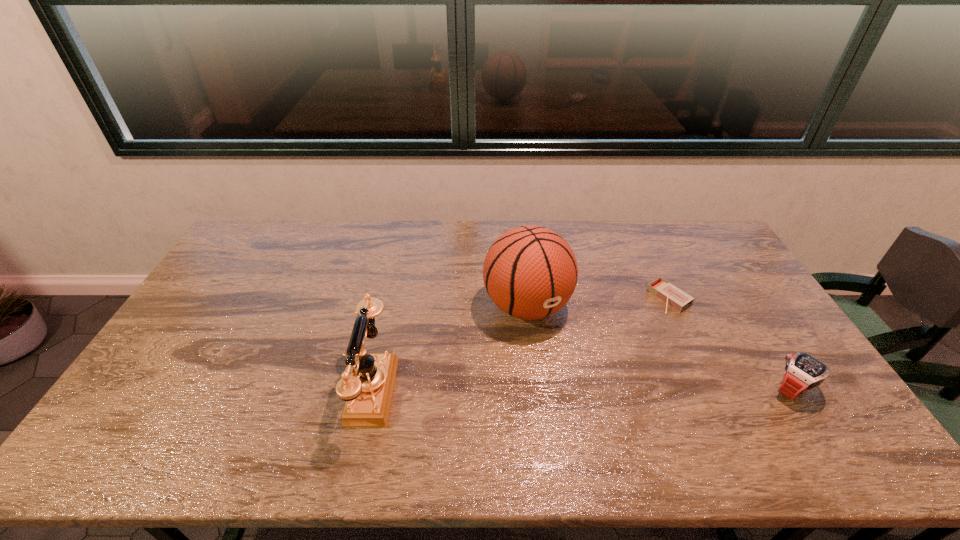
You are a GUI agent. You are given a task and a screenshot of the screen. Output one action in this format:
    pyautogui.click(x=<x>, y=<y>)
    Task: Click on the vacant region that satisfies the following two spatial constraints: 1. on the front side of the rightmost object; 2. on the right side of the matchbox
    This screenshot has width=960, height=540.
    Given the screenshot: What is the action you would take?
    pyautogui.click(x=711, y=389)

The width and height of the screenshot is (960, 540). In order to click on free space that satisfies the following two spatial constraints: 1. on the front side of the second object from left to right; 2. on the right side of the watch in this screenshot , I will do `click(536, 389)`.